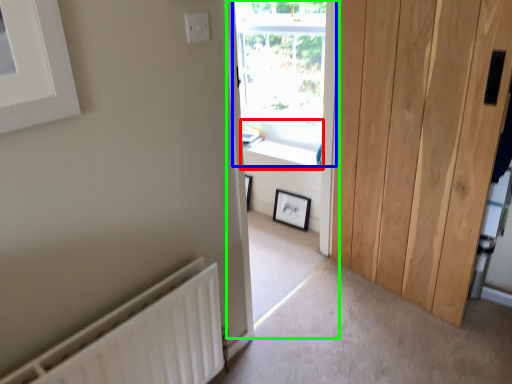
Question: Considering the real-world distances, which object is closest to window sill (highlighted by a red box)? window (highlighted by a blue box) or window frame (highlighted by a green box).

Choices:
 (A) window
 (B) window frame

Answer: (B)